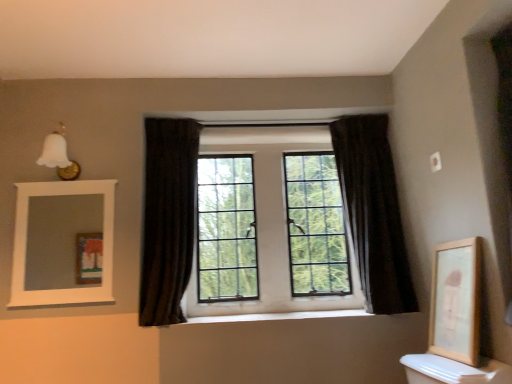
In order to face wooden framed artwork at right, should I rotate leftwards or rightwards?

To face it directly, rotate right by 24.868 degrees.

What do you see at coordinates (373, 211) in the screenshot? I see `dark fabric curtain at center, the 2th curtain positioned from the left` at bounding box center [373, 211].

Measure the distance between dark velvet curtain at center, acting as the first curtain starting from the left, and camera.

The distance of dark velvet curtain at center, acting as the first curtain starting from the left, from camera is 2.03 meters.

You are a GUI agent. You are given a task and a screenshot of the screen. Output one action in this format:
    pyautogui.click(x=<x>, y=<y>)
    Task: Click on the dark velvet curtain at center, positioned as the 2th curtain in right-to-left order
    
    Given the screenshot: What is the action you would take?
    pyautogui.click(x=167, y=218)

You are a GUI agent. You are given a task and a screenshot of the screen. Output one action in this format:
    pyautogui.click(x=<x>, y=<y>)
    Task: Click on the white wooden mirror at upper left
    This screenshot has width=512, height=384.
    Given the screenshot: What is the action you would take?
    pyautogui.click(x=60, y=239)

In the scene shown: What is the approximate width of white smooth window sill at center?

14.21 inches.

Where is `white smooth window sill at center`? The height and width of the screenshot is (384, 512). white smooth window sill at center is located at coordinates (278, 316).

Identify the location of wooden framed artwork at right. The height and width of the screenshot is (384, 512). (456, 301).

Which of these two, clear glass windows at center or white wooden mirror at upper left, is thinner?

Thinner between the two is white wooden mirror at upper left.

Between clear glass windows at center and white wooden mirror at upper left, which one has larger size?

clear glass windows at center.

Considering the positions of objects clear glass windows at center and white wooden mirror at upper left in the image provided, who is behind, clear glass windows at center or white wooden mirror at upper left?

clear glass windows at center is behind.

From the image's perspective, is clear glass windows at center above or below white wooden mirror at upper left?

Clearly, from the image's perspective, clear glass windows at center is above white wooden mirror at upper left.

Considering the sizes of objects white wooden mirror at upper left and dark fabric curtain at center, the 2th curtain positioned from the left, in the image provided, who is wider, white wooden mirror at upper left or dark fabric curtain at center, the 2th curtain positioned from the left,?

dark fabric curtain at center, the 2th curtain positioned from the left.

From the image's perspective, is white wooden mirror at upper left on dark fabric curtain at center, the 2th curtain positioned from the left?

No, from the image's perspective, white wooden mirror at upper left is not above dark fabric curtain at center, the 2th curtain positioned from the left.

From a real-world perspective, is white wooden mirror at upper left under dark fabric curtain at center, arranged as the first curtain when viewed from the right?

Indeed, from a real-world perspective, white wooden mirror at upper left is positioned beneath dark fabric curtain at center, arranged as the first curtain when viewed from the right.

I want to click on mirror in front of the dark fabric curtain at center, arranged as the first curtain when viewed from the right, so click(60, 239).

Considering the sizes of white smooth window sill at center and dark velvet curtain at center, positioned as the 2th curtain in right-to-left order, in the image, is white smooth window sill at center wider or thinner than dark velvet curtain at center, positioned as the 2th curtain in right-to-left order,?

Considering their sizes, white smooth window sill at center looks broader than dark velvet curtain at center, positioned as the 2th curtain in right-to-left order.

Considering the relative positions of white smooth window sill at center and dark velvet curtain at center, acting as the first curtain starting from the left, in the image provided, is white smooth window sill at center to the left or to the right of dark velvet curtain at center, acting as the first curtain starting from the left,?

white smooth window sill at center is to the right of dark velvet curtain at center, acting as the first curtain starting from the left.

Which point is more forward, (262, 314) or (183, 226)?

The point (183, 226) is closer.

From their relative heights in the image, would you say white smooth window sill at center is taller or shorter than dark velvet curtain at center, acting as the first curtain starting from the left?

Clearly, white smooth window sill at center is shorter compared to dark velvet curtain at center, acting as the first curtain starting from the left.

Looking at this image, is dark fabric curtain at center, the 2th curtain positioned from the left, inside or outside of dark velvet curtain at center, acting as the first curtain starting from the left?

dark fabric curtain at center, the 2th curtain positioned from the left, is located beyond the bounds of dark velvet curtain at center, acting as the first curtain starting from the left.

You are a GUI agent. You are given a task and a screenshot of the screen. Output one action in this format:
    pyautogui.click(x=<x>, y=<y>)
    Task: Click on the curtain behind the dark velvet curtain at center, positioned as the 2th curtain in right-to-left order
    
    Given the screenshot: What is the action you would take?
    pyautogui.click(x=373, y=211)

Is dark fabric curtain at center, the 2th curtain positioned from the left, looking in the opposite direction of dark velvet curtain at center, acting as the first curtain starting from the left?

No, dark velvet curtain at center, acting as the first curtain starting from the left, is not at the back of dark fabric curtain at center, the 2th curtain positioned from the left.

The width and height of the screenshot is (512, 384). What are the coordinates of `the 2nd curtain to the right of the white wooden mirror at upper left, starting your count from the anchor` in the screenshot? It's located at (373, 211).

Which is closer, (x=378, y=221) or (x=67, y=196)?

Point (x=378, y=221).

In terms of height, does dark fabric curtain at center, the 2th curtain positioned from the left, look taller or shorter compared to white wooden mirror at upper left?

In the image, dark fabric curtain at center, the 2th curtain positioned from the left, appears to be taller than white wooden mirror at upper left.

Are dark fabric curtain at center, arranged as the first curtain when viewed from the right, and white wooden mirror at upper left making contact?

No, dark fabric curtain at center, arranged as the first curtain when viewed from the right, is not making contact with white wooden mirror at upper left.

Which of these two, wooden framed artwork at right or dark fabric curtain at center, arranged as the first curtain when viewed from the right, is bigger?

With larger size is dark fabric curtain at center, arranged as the first curtain when viewed from the right.

Is wooden framed artwork at right to the right of dark fabric curtain at center, the 2th curtain positioned from the left, from the viewer's perspective?

Yes, wooden framed artwork at right is to the right of dark fabric curtain at center, the 2th curtain positioned from the left.

Is wooden framed artwork at right looking in the opposite direction of dark fabric curtain at center, arranged as the first curtain when viewed from the right?

No, wooden framed artwork at right's orientation is not away from dark fabric curtain at center, arranged as the first curtain when viewed from the right.

From a real-world perspective, is dark velvet curtain at center, acting as the first curtain starting from the left, located higher than wooden framed artwork at right?

Yes, from a real-world perspective, dark velvet curtain at center, acting as the first curtain starting from the left, is on top of wooden framed artwork at right.

Can you confirm if dark velvet curtain at center, positioned as the 2th curtain in right-to-left order, is taller than wooden framed artwork at right?

Yes, dark velvet curtain at center, positioned as the 2th curtain in right-to-left order, is taller than wooden framed artwork at right.

Considering their positions, is dark velvet curtain at center, acting as the first curtain starting from the left, located in front of or behind wooden framed artwork at right?

Visually, dark velvet curtain at center, acting as the first curtain starting from the left, is located behind wooden framed artwork at right.

The image size is (512, 384). I want to click on mirror on the left of clear glass windows at center, so click(x=60, y=239).

This screenshot has height=384, width=512. I want to click on mirror in front of the dark fabric curtain at center, arranged as the first curtain when viewed from the right, so click(60, 239).

Looking at the image, which one is located closer to dark velvet curtain at center, positioned as the 2th curtain in right-to-left order, dark fabric curtain at center, arranged as the first curtain when viewed from the right, or wooden framed artwork at right?

The object closer to dark velvet curtain at center, positioned as the 2th curtain in right-to-left order, is dark fabric curtain at center, arranged as the first curtain when viewed from the right.

Considering their positions, is dark velvet curtain at center, acting as the first curtain starting from the left, positioned closer to wooden framed artwork at right than white wooden mirror at upper left?

dark velvet curtain at center, acting as the first curtain starting from the left, is positioned closer to the anchor wooden framed artwork at right.

Looking at the image, which one is located closer to white wooden mirror at upper left, dark fabric curtain at center, the 2th curtain positioned from the left, or dark velvet curtain at center, positioned as the 2th curtain in right-to-left order?

dark velvet curtain at center, positioned as the 2th curtain in right-to-left order.

When comparing their distances from dark velvet curtain at center, acting as the first curtain starting from the left, does white smooth window sill at center or dark fabric curtain at center, arranged as the first curtain when viewed from the right, seem further?

Based on the image, dark fabric curtain at center, arranged as the first curtain when viewed from the right, appears to be further to dark velvet curtain at center, acting as the first curtain starting from the left.

From the image, which object appears to be nearer to white wooden mirror at upper left, dark velvet curtain at center, positioned as the 2th curtain in right-to-left order, or clear glass windows at center?

Based on the image, dark velvet curtain at center, positioned as the 2th curtain in right-to-left order, appears to be nearer to white wooden mirror at upper left.

From the image, which object appears to be nearer to wooden framed artwork at right, white wooden mirror at upper left or clear glass windows at center?

Based on the image, clear glass windows at center appears to be nearer to wooden framed artwork at right.

Which object lies further to the anchor point white wooden mirror at upper left, dark velvet curtain at center, positioned as the 2th curtain in right-to-left order, or dark fabric curtain at center, the 2th curtain positioned from the left?

dark fabric curtain at center, the 2th curtain positioned from the left.

Estimate the real-world distances between objects in this image. Which object is closer to clear glass windows at center, white smooth window sill at center or wooden framed artwork at right?

white smooth window sill at center lies closer to clear glass windows at center than the other object.

Where is `window sill between dark velvet curtain at center, positioned as the 2th curtain in right-to-left order, and dark fabric curtain at center, the 2th curtain positioned from the left, in the horizontal direction`? window sill between dark velvet curtain at center, positioned as the 2th curtain in right-to-left order, and dark fabric curtain at center, the 2th curtain positioned from the left, in the horizontal direction is located at coordinates [x=278, y=316].

Image resolution: width=512 pixels, height=384 pixels. Identify the location of bay window situated between dark velvet curtain at center, positioned as the 2th curtain in right-to-left order, and white smooth window sill at center from left to right. (272, 230).

Identify the location of bay window between dark velvet curtain at center, positioned as the 2th curtain in right-to-left order, and wooden framed artwork at right from left to right. The image size is (512, 384). (272, 230).

Locate an element on the screen. This screenshot has width=512, height=384. window sill between dark velvet curtain at center, positioned as the 2th curtain in right-to-left order, and wooden framed artwork at right is located at coordinates (278, 316).